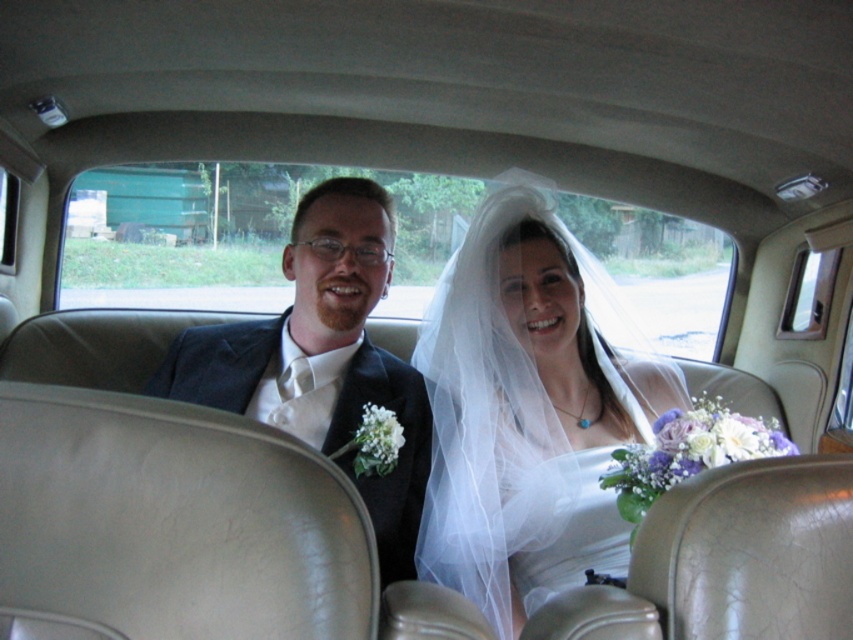
You are standing 5 feet away from the point at coordinates point (x=432, y=356). If you move forward 2 feet, will you be closer to or farther from the point?

Moving forward 2 feet from your current position 5 feet away from the point at coordinates point (x=432, y=356) would bring you to 3 feet away, which is closer.

You are a photographer positioned outside the vintage car. You need to capture a photo of the white sheer veil at center and the matte black suit at left without any overlap between them. Given that your camera has a maximum focus range of 12 inches, will you be able to achieve this shot?

The white sheer veil at center and the matte black suit at left are 11.35 inches apart from each other. Since the distance between them is within the camera maximum focus range of 12 inches, the photographer can capture the photo without overlap.

You are a photographer positioned outside the vintage car. You notice the white sheer veil at center and the matte black suit at left. Which object is closer to the bottom edge of the car window?

The white sheer veil at center is located below the matte black suit at left, so it is closer to the bottom edge of the car window.